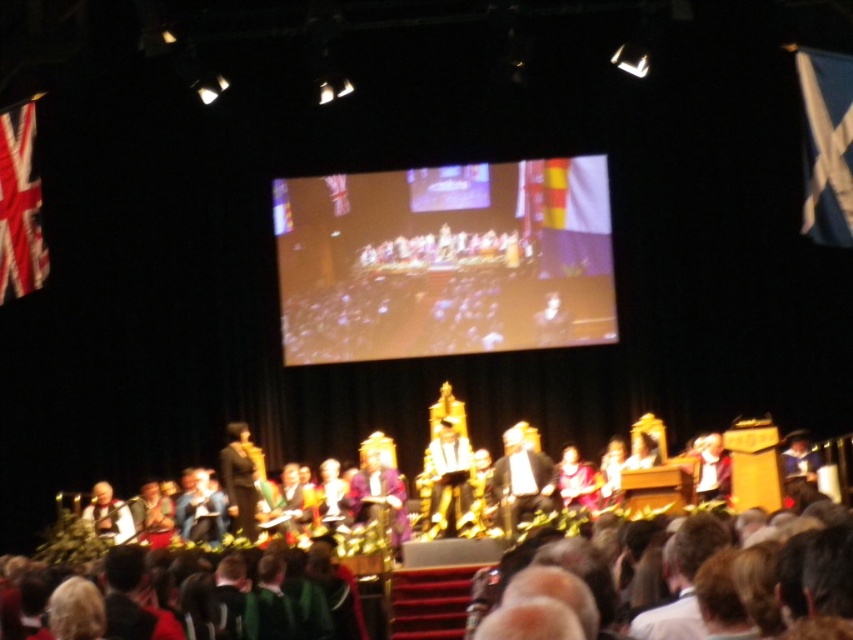
Is point (457, 454) less distant than point (361, 508)?

No, (457, 454) is further to viewer.

Between point (463, 513) and point (347, 497), which one is positioned in front?

Positioned in front is point (463, 513).

Who is more distant from viewer, (447, 452) or (378, 486)?

Positioned behind is point (378, 486).

The width and height of the screenshot is (853, 640). In order to click on gold metallic statue at center in this screenshot , I will do `click(448, 477)`.

Is point (375, 499) positioned before point (100, 522)?

Yes, point (375, 499) is closer to viewer.

Who is more distant from viewer, (x=386, y=464) or (x=122, y=532)?

Positioned behind is point (x=386, y=464).

Where is `purple velvet robe at center`? purple velvet robe at center is located at coordinates (379, 497).

Who is higher up, silk white robe at center or gold metallic statue at center?

gold metallic statue at center is above.

Which is more to the left, silk white robe at center or gold metallic statue at center?

gold metallic statue at center

Measure the distance between silk white robe at center and camera.

A distance of 77.74 meters exists between silk white robe at center and camera.

You are a GUI agent. You are given a task and a screenshot of the screen. Output one action in this format:
    pyautogui.click(x=<x>, y=<y>)
    Task: Click on the silk white robe at center
    This screenshot has height=640, width=853.
    Given the screenshot: What is the action you would take?
    pyautogui.click(x=520, y=480)